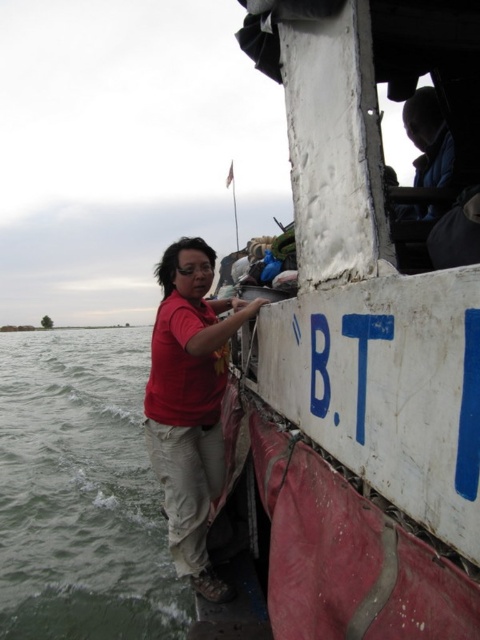
Can you confirm if white matte boat at upper right is wider than green water at lower left?

No.

Based on the photo, does white matte boat at upper right appear on the right side of green water at lower left?

Indeed, white matte boat at upper right is positioned on the right side of green water at lower left.

This screenshot has height=640, width=480. Find the location of `white matte boat at upper right`. white matte boat at upper right is located at coordinates (359, 346).

Does white matte boat at upper right appear on the right side of matte red shirt at center?

Yes, white matte boat at upper right is to the right of matte red shirt at center.

Who is more forward, (404, 540) or (171, 490)?

Point (404, 540) is in front.

Who is more distant from viewer, (380, 580) or (167, 340)?

Point (167, 340)

Locate an element on the screen. The image size is (480, 640). white matte boat at upper right is located at coordinates coord(359,346).

Can you confirm if green water at lower left is positioned below matte red shirt at center?

Correct, green water at lower left is located below matte red shirt at center.

Is green water at lower left closer to the viewer compared to matte red shirt at center?

That is False.

Is point (54, 344) behind point (168, 364)?

Yes, point (54, 344) is farther from viewer.

Locate an element on the screen. green water at lower left is located at coordinates tap(81, 492).